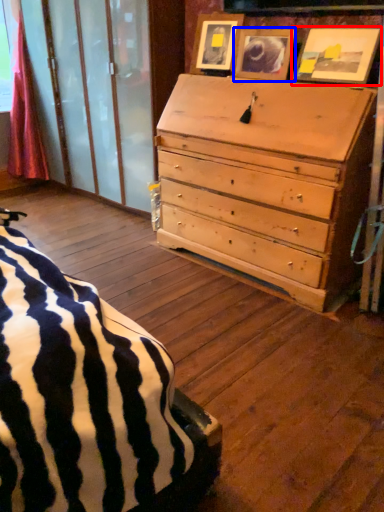
Question: Which point is closer to the camera, picture frame (highlighted by a red box) or picture frame (highlighted by a blue box)?

Choices:
 (A) picture frame
 (B) picture frame

Answer: (A)